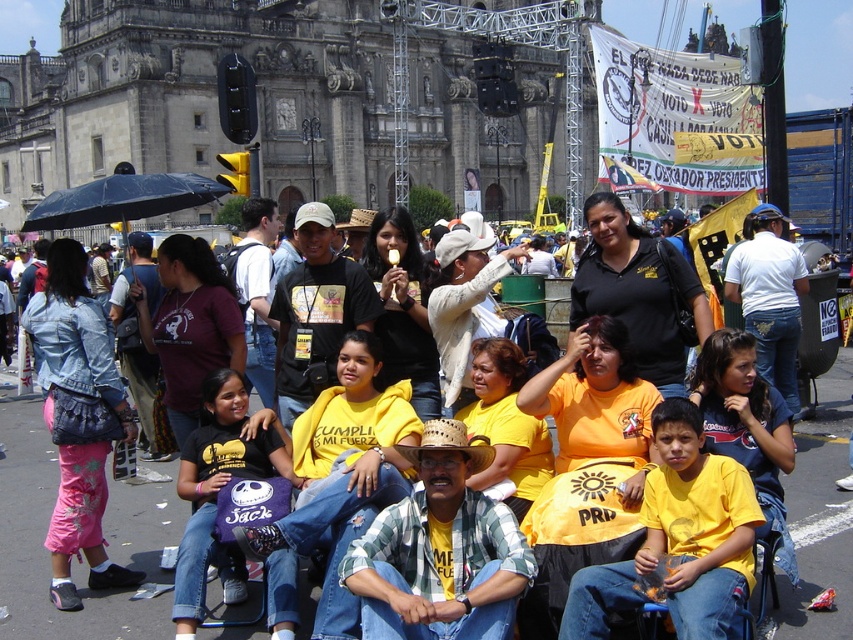
Question: Among these objects, which one is nearest to the camera?

Choices:
 (A) yellow/yellow shirt at center
 (B) black matte umbrella at upper left

Answer: (A)

Question: Which point is farther from the camera taking this photo?

Choices:
 (A) (239, 612)
 (B) (155, 180)

Answer: (B)

Question: Is yellow/yellow shirt at center bigger than black matte umbrella at upper left?

Choices:
 (A) no
 (B) yes

Answer: (B)

Question: Among these points, which one is farthest from the camera?

Choices:
 (A) (x=107, y=513)
 (B) (x=126, y=218)

Answer: (B)

Question: Does yellow/yellow shirt at center appear on the left side of black matte umbrella at upper left?

Choices:
 (A) yes
 (B) no

Answer: (B)

Question: Is yellow/yellow shirt at center bigger than black matte umbrella at upper left?

Choices:
 (A) no
 (B) yes

Answer: (B)